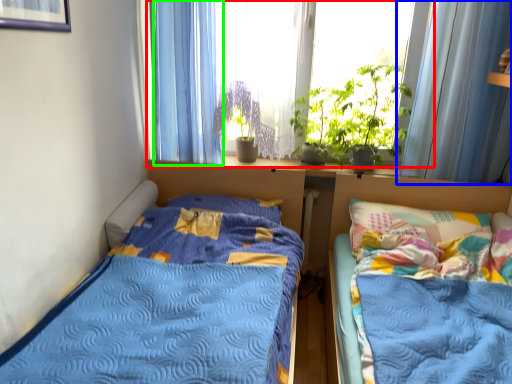
Question: Based on their relative distances, which object is nearer to window (highlighted by a red box)? Choose from curtain (highlighted by a blue box) and curtain (highlighted by a green box).

Choices:
 (A) curtain
 (B) curtain

Answer: (B)